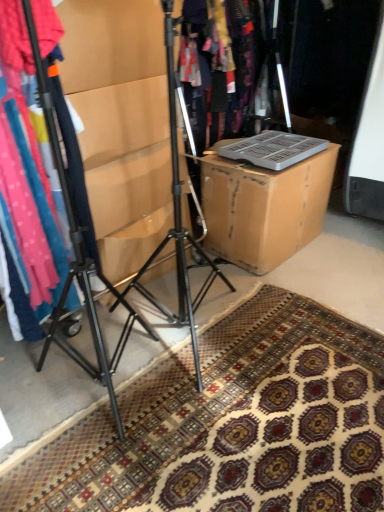
What do you see at coordinates (121, 124) in the screenshot? This screenshot has height=512, width=384. I see `matte cardboard box at center` at bounding box center [121, 124].

What do you see at coordinates (230, 424) in the screenshot? I see `patterned carpet at lower center` at bounding box center [230, 424].

What do you see at coordinates (263, 207) in the screenshot? This screenshot has height=512, width=384. I see `brown cardboard box at center` at bounding box center [263, 207].

Find the location of `matte cardboard box at center`. matte cardboard box at center is located at coordinates (121, 124).

Is matte cardboard box at center surrounding matte plastic laptop at center?

No, matte plastic laptop at center is not inside matte cardboard box at center.

From a real-world perspective, which object rests below the other?

From a 3D spatial view, matte cardboard box at center is below.

Is point (83, 68) closer or farther from the camera than point (254, 73)?

Clearly, point (83, 68) is closer to the camera than point (254, 73).

Is matte cardboard box at center facing towards matte plastic laptop at center?

No, matte cardboard box at center is not turned towards matte plastic laptop at center.

Is patterned carpet at lower center not inside matte cardboard box at center?

Yes, patterned carpet at lower center is not within matte cardboard box at center.

Consider the image. Between patterned carpet at lower center and matte cardboard box at center, which one has less height?

Standing shorter between the two is patterned carpet at lower center.

Considering the sizes of objects patterned carpet at lower center and matte cardboard box at center in the image provided, who is smaller, patterned carpet at lower center or matte cardboard box at center?

With smaller size is patterned carpet at lower center.

Can you tell me how much patterned carpet at lower center and matte cardboard box at center differ in facing direction?

The angular difference between patterned carpet at lower center and matte cardboard box at center is 92 degrees.

From the image's perspective, which one is positioned higher, matte plastic laptop at center or brown cardboard box at center?

matte plastic laptop at center.

Based on their positions, is matte plastic laptop at center located to the left or right of brown cardboard box at center?

Based on their positions, matte plastic laptop at center is located to the left of brown cardboard box at center.

Considering the relative sizes of matte plastic laptop at center and brown cardboard box at center in the image provided, is matte plastic laptop at center taller than brown cardboard box at center?

Correct, matte plastic laptop at center is much taller as brown cardboard box at center.

Is brown cardboard box at center not close to black metal tripod at center?

That's not correct — brown cardboard box at center is a little close to black metal tripod at center.

Between brown cardboard box at center and black metal tripod at center, which one appears on the right side from the viewer's perspective?

Positioned to the right is brown cardboard box at center.

Considering the relative sizes of brown cardboard box at center and black metal tripod at center in the image provided, is brown cardboard box at center smaller than black metal tripod at center?

Actually, brown cardboard box at center might be larger than black metal tripod at center.

Who is shorter, brown cardboard box at center or black metal tripod at center?

With less height is brown cardboard box at center.

How many degrees apart are the facing directions of matte cardboard box at center and black metal tripod at center?

The angle between the facing direction of matte cardboard box at center and the facing direction of black metal tripod at center is 80.5 degrees.

Is matte cardboard box at center smaller than black metal tripod at center?

No.

From a real-world perspective, who is located higher, matte cardboard box at center or black metal tripod at center?

black metal tripod at center.

Does matte cardboard box at center have a lesser height compared to black metal tripod at center?

No.

Is patterned carpet at lower center positioned far away from black metal tripod at center?

patterned carpet at lower center is actually quite close to black metal tripod at center.

What's the angular difference between patterned carpet at lower center and black metal tripod at center's facing directions?

The angular difference between patterned carpet at lower center and black metal tripod at center is 11.5 degrees.

Is black metal tripod at center a part of patterned carpet at lower center?

Actually, black metal tripod at center is outside patterned carpet at lower center.

Considering the relative sizes of black metal tripod at center and brown cardboard box at center in the image provided, is black metal tripod at center wider than brown cardboard box at center?

No.

Would you say black metal tripod at center is a long distance from brown cardboard box at center?

No.

Based on their positions, is black metal tripod at center located to the left or right of brown cardboard box at center?

Clearly, black metal tripod at center is on the left of brown cardboard box at center in the image.

Is black metal tripod at center facing away from brown cardboard box at center?

Yes, brown cardboard box at center is at the back of black metal tripod at center.

Where is `clothing above the matte cardboard box at center (from the image's perspective)`? This screenshot has width=384, height=512. clothing above the matte cardboard box at center (from the image's perspective) is located at coordinates (214, 68).

The width and height of the screenshot is (384, 512). I want to click on doormat on the right side of matte cardboard box at center, so 230,424.

Looking at the image, which one is located closer to patterned carpet at lower center, black metal tripod at center or matte cardboard box at center?

black metal tripod at center is positioned closer to the anchor patterned carpet at lower center.

When comparing their distances from brown cardboard box at center, does patterned carpet at lower center or matte plastic laptop at center seem further?

Based on the image, matte plastic laptop at center appears to be further to brown cardboard box at center.

Which object lies further to the anchor point brown cardboard box at center, black metal tripod at center or matte cardboard box at center?

The object further to brown cardboard box at center is black metal tripod at center.

Considering their positions, is matte plastic laptop at center positioned closer to patterned carpet at lower center than matte cardboard box at center?

matte cardboard box at center is closer to patterned carpet at lower center.

From the image, which object appears to be farther from patterned carpet at lower center, matte cardboard box at center or black metal tripod at center?

matte cardboard box at center is positioned further to the anchor patterned carpet at lower center.

When comparing their distances from black metal tripod at center, does matte plastic laptop at center or brown cardboard box at center seem closer?

The object closer to black metal tripod at center is brown cardboard box at center.

From the image, which object appears to be nearer to patterned carpet at lower center, brown cardboard box at center or matte plastic laptop at center?

brown cardboard box at center.

From the image, which object appears to be farther from matte plastic laptop at center, patterned carpet at lower center or black metal tripod at center?

Based on the image, patterned carpet at lower center appears to be further to matte plastic laptop at center.

This screenshot has height=512, width=384. What are the coordinates of `tripod between matte cardboard box at center and patterned carpet at lower center from top to bottom` in the screenshot? It's located at (77, 252).

Where is `closet between matte plastic laptop at center and patterned carpet at lower center from top to bottom`? The height and width of the screenshot is (512, 384). closet between matte plastic laptop at center and patterned carpet at lower center from top to bottom is located at coordinates (121, 124).

Locate an element on the screen. The width and height of the screenshot is (384, 512). tripod between patterned carpet at lower center and brown cardboard box at center from front to back is located at coordinates (77, 252).

You are a GUI agent. You are given a task and a screenshot of the screen. Output one action in this format:
    pyautogui.click(x=<x>, y=<y>)
    Task: Click on the closet located between black metal tripod at center and matte plastic laptop at center in the depth direction
    
    Given the screenshot: What is the action you would take?
    pyautogui.click(x=121, y=124)